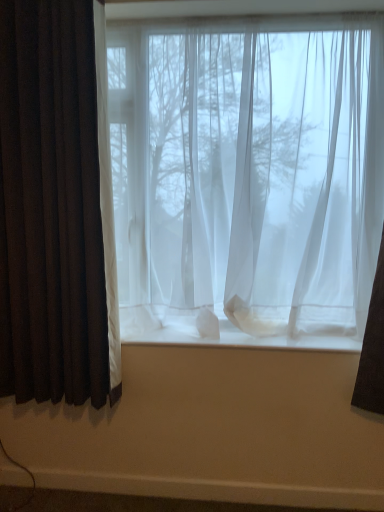
Question: Does dark brown velvet curtain at left have a lesser height compared to white sheer curtain at center?

Choices:
 (A) no
 (B) yes

Answer: (A)

Question: Would you say white sheer curtain at center is part of dark brown velvet curtain at left's contents?

Choices:
 (A) no
 (B) yes

Answer: (A)

Question: From a real-world perspective, is dark brown velvet curtain at left physically below white sheer curtain at center?

Choices:
 (A) no
 (B) yes

Answer: (A)

Question: From a real-world perspective, is dark brown velvet curtain at left positioned over white sheer curtain at center based on gravity?

Choices:
 (A) yes
 (B) no

Answer: (A)

Question: Can you confirm if dark brown velvet curtain at left is thinner than white sheer curtain at center?

Choices:
 (A) yes
 (B) no

Answer: (A)

Question: Is dark brown velvet curtain at left smaller than white sheer curtain at center?

Choices:
 (A) no
 (B) yes

Answer: (A)

Question: From a real-world perspective, is white sheer curtain at center below sheer white curtains at center?

Choices:
 (A) yes
 (B) no

Answer: (A)

Question: Can you confirm if white sheer curtain at center is bigger than sheer white curtains at center?

Choices:
 (A) yes
 (B) no

Answer: (B)

Question: Is white sheer curtain at center oriented towards sheer white curtains at center?

Choices:
 (A) yes
 (B) no

Answer: (B)

Question: Is white sheer curtain at center directly adjacent to sheer white curtains at center?

Choices:
 (A) yes
 (B) no

Answer: (B)

Question: Considering the relative sizes of white sheer curtain at center and sheer white curtains at center in the image provided, is white sheer curtain at center shorter than sheer white curtains at center?

Choices:
 (A) no
 (B) yes

Answer: (B)

Question: Can we say white sheer curtain at center lies outside sheer white curtains at center?

Choices:
 (A) yes
 (B) no

Answer: (A)

Question: Can you confirm if sheer white curtains at center is shorter than white sheer curtain at center?

Choices:
 (A) yes
 (B) no

Answer: (B)